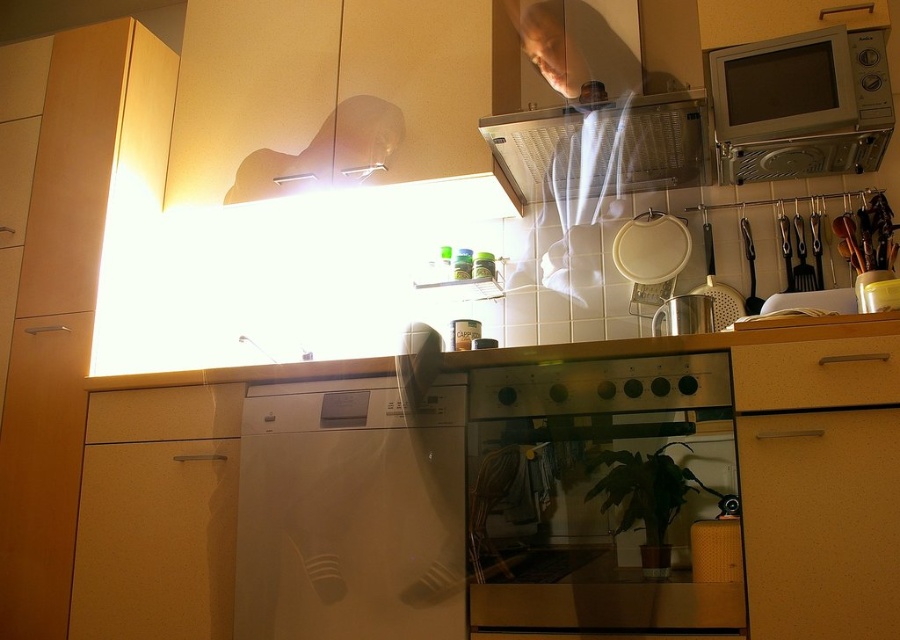
You are a kitchen designer and need to place a new appliance. The point at coordinates (349,513) marks the location of the white glossy dishwasher at center. Where should you position the dishwasher to ensure it aligns with the existing kitchen layout?

The point at coordinates (349,513) indicates the white glossy dishwasher at center is already positioned at the center, so it aligns with the existing kitchen layout.

You are a chef in a kitchen with a satin silver oven at center. You need to place a dish exactly at point (603, 499). Is this point on the satin silver oven at center?

Yes, the point (603, 499) is on the satin silver oven at center according to the description.

In the scene shown: You are designing a kitchen layout and need to place a microwave on top of the white glossy dishwasher at center. The microwave requires a surface height of at least 10 inches. Based on the scene description, can the matte wood drawer at lower left be used as a reference to determine if the dishwasher is tall enough?

The white glossy dishwasher at center has a greater height compared to matte wood drawer at lower left. Since the microwave requires a surface height of at least 10 inches, and the dishwasher is taller than the drawer, it is likely that the dishwasher meets the height requirement. However, without knowing the exact height of the drawer, we cannot confirm definitively.